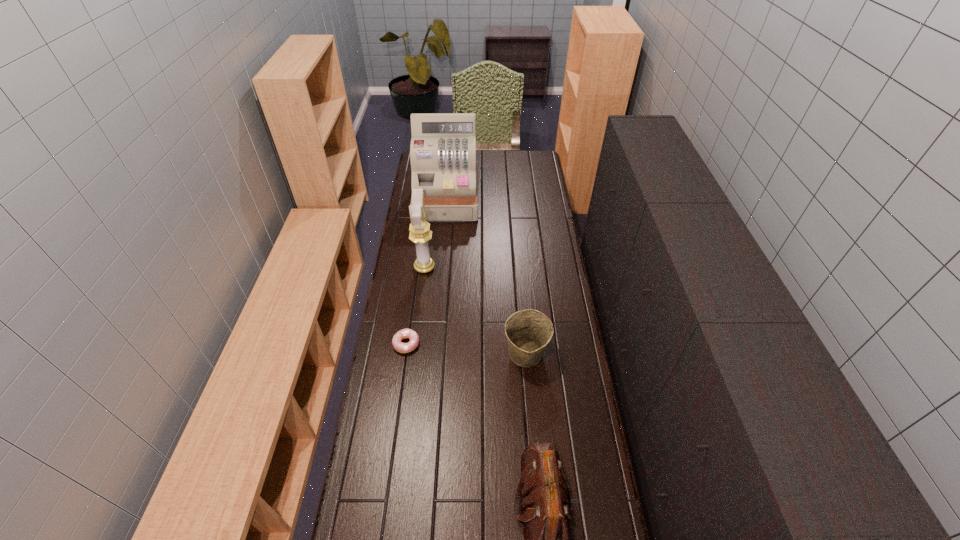
At what (x,y) coordinates should I click in order to perform the action: click on doughnut situated at the left edge. Please return your answer as a coordinate pair (x, y). Looking at the image, I should click on (399, 346).

At what (x,y) coordinates should I click in order to perform the action: click on object present at the right edge. Please return your answer as a coordinate pair (x, y). Image resolution: width=960 pixels, height=540 pixels. Looking at the image, I should click on (529, 331).

Locate an element on the screen. The height and width of the screenshot is (540, 960). vacant space at the left edge is located at coordinates (433, 257).

This screenshot has height=540, width=960. In order to click on free space at the right edge of the desktop in this screenshot , I will do `click(546, 210)`.

Find the location of `vacant area that lies between the farthest object and the award`. vacant area that lies between the farthest object and the award is located at coordinates (436, 233).

Find the location of a particular element. This screenshot has width=960, height=540. vacant area between the cash register and the wine bucket is located at coordinates (487, 277).

This screenshot has height=540, width=960. What are the coordinates of `blank region between the fourth nearest object and the doughnut` in the screenshot? It's located at (416, 306).

Identify the location of free spot between the second farthest object and the wine bucket. (475, 310).

Locate an element on the screen. Image resolution: width=960 pixels, height=540 pixels. free space between the doughnut and the wine bucket is located at coordinates (467, 349).

Locate which object is the closest to the cash register. Please provide its 2D coordinates. Your answer should be formatted as a tuple, i.e. [(x, y)], where the tuple contains the x and y coordinates of a point satisfying the conditions above.

[(420, 233)]